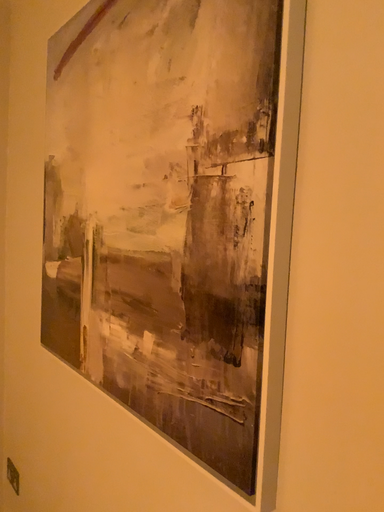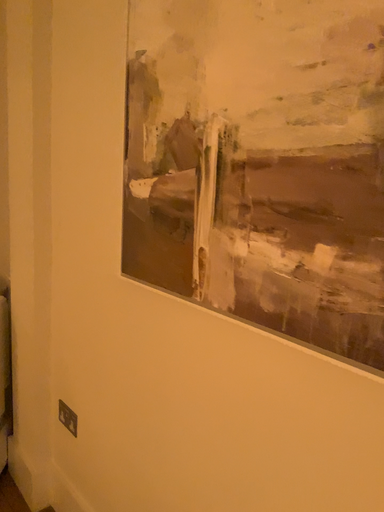
Question: How did the camera likely rotate when shooting the video?

Choices:
 (A) rotated upward
 (B) rotated downward

Answer: (B)